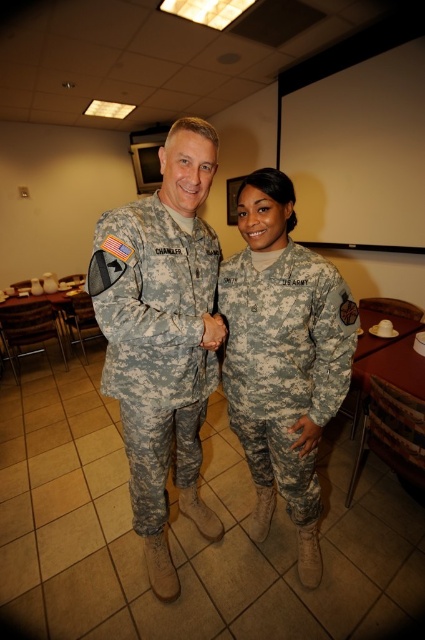
Does point (226, 381) come in front of point (291, 504)?

Yes.

Does camouflage uniform at center come behind digital camouflage uniform at center?

Answer: No, it is in front of digital camouflage uniform at center.

You are a GUI agent. You are given a task and a screenshot of the screen. Output one action in this format:
    pyautogui.click(x=<x>, y=<y>)
    Task: Click on the camouflage uniform at center
    Image resolution: width=425 pixels, height=640 pixels.
    Given the screenshot: What is the action you would take?
    pyautogui.click(x=283, y=356)

Does camouflage fabric uniform at center appear on the left side of digital camouflage uniform at center?

Correct, you'll find camouflage fabric uniform at center to the left of digital camouflage uniform at center.

Is point (192, 275) farther from viewer compared to point (229, 301)?

No, (192, 275) is closer to viewer.

The height and width of the screenshot is (640, 425). Find the location of `camouflage fabric uniform at center`. camouflage fabric uniform at center is located at coordinates (155, 342).

Which is in front, point (311, 561) or point (141, 262)?

Point (141, 262) is more forward.

Does camouflage uniform at center come behind camouflage fabric uniform at center?

That is True.

This screenshot has width=425, height=640. What do you see at coordinates (283, 356) in the screenshot? I see `camouflage uniform at center` at bounding box center [283, 356].

This screenshot has height=640, width=425. I want to click on camouflage uniform at center, so click(283, 356).